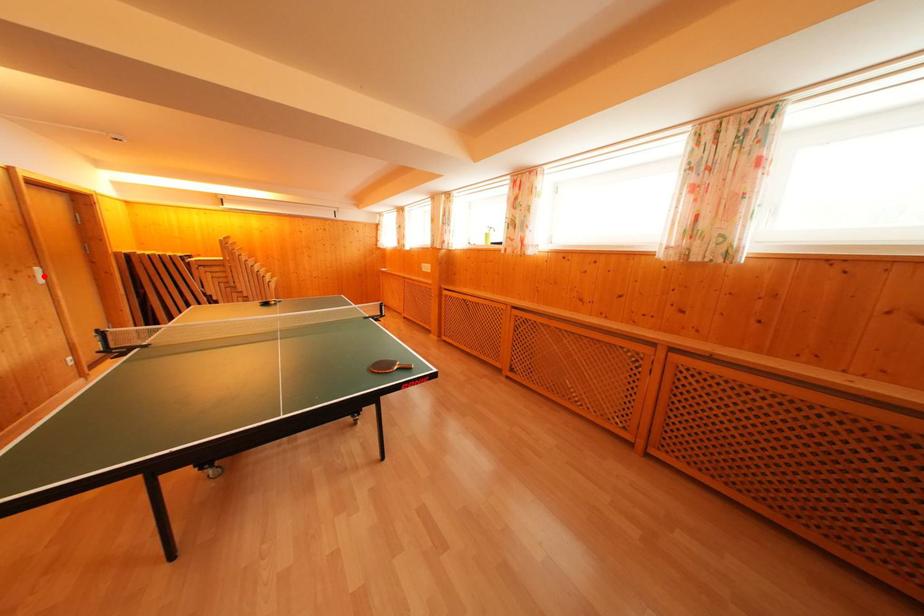
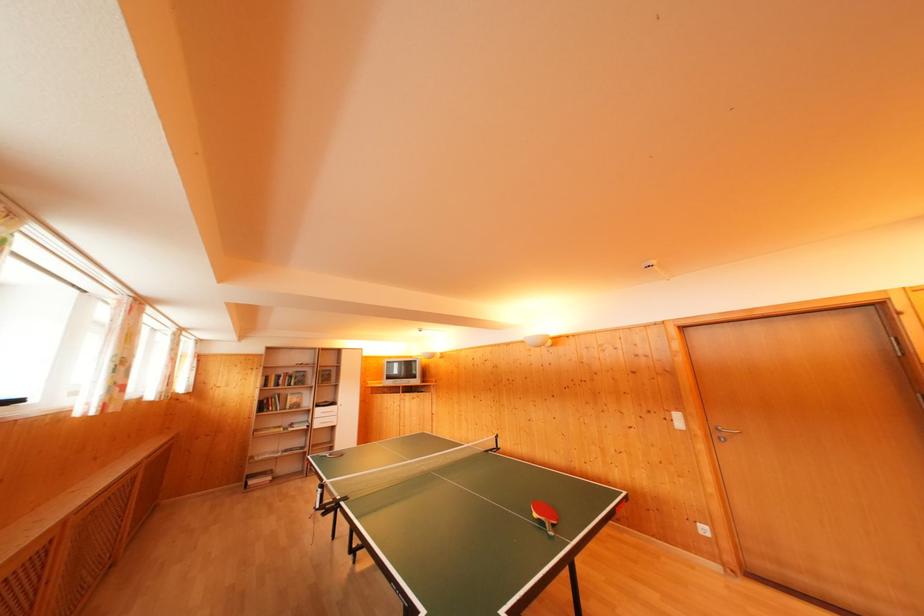
In the second image, find the point that corresponds to the highlighted location in the first image.

(682, 421)